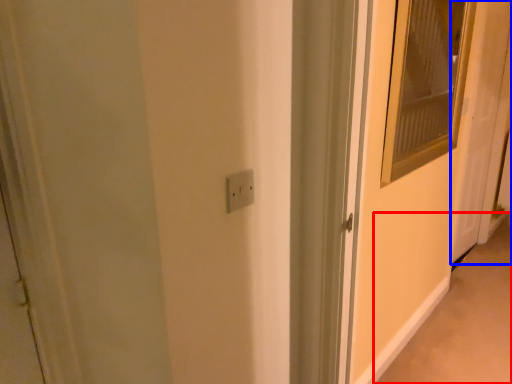
Question: Which object appears closest to the camera in this image, alley (highlighted by a red box) or door (highlighted by a blue box)?

Choices:
 (A) alley
 (B) door

Answer: (A)